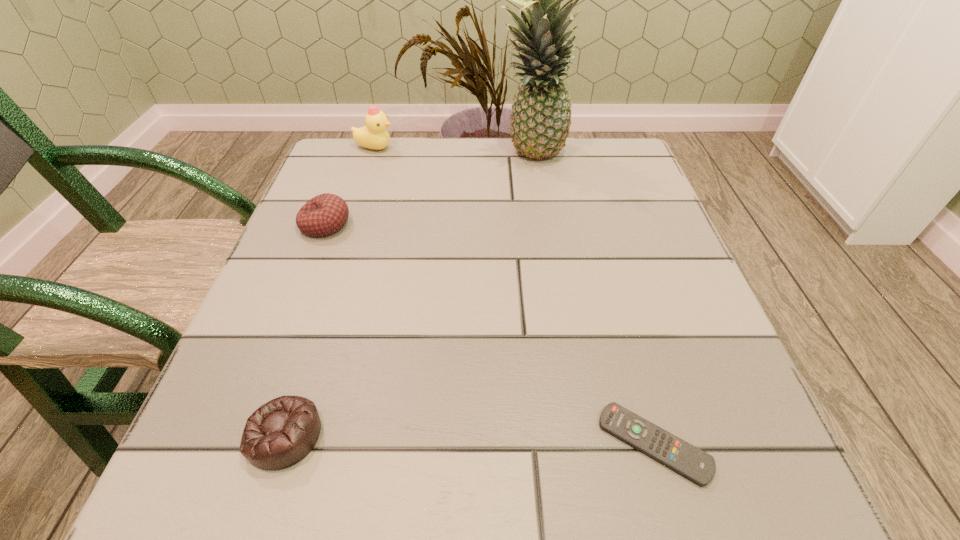
This screenshot has width=960, height=540. In order to click on pineapple in this screenshot , I will do `click(541, 115)`.

Where is `the second tallest object`? The width and height of the screenshot is (960, 540). the second tallest object is located at coordinates (374, 135).

In order to click on the farther beanbag in this screenshot , I will do `click(323, 215)`.

Where is `the third nearest object`? The image size is (960, 540). the third nearest object is located at coordinates (323, 215).

Find the location of a particular element. the nearer beanbag is located at coordinates (279, 434).

You are a GUI agent. You are given a task and a screenshot of the screen. Output one action in this format:
    pyautogui.click(x=<x>, y=<y>)
    Task: Click on the shorter beanbag
    
    Given the screenshot: What is the action you would take?
    pyautogui.click(x=279, y=434)

Identify the location of remote control. pos(699,467).

The width and height of the screenshot is (960, 540). Identify the location of vacant space located on the right of the tallest object. (633, 155).

Find the location of `vacant area situated 0.240m on the front-facing side of the fourth shortest object`. vacant area situated 0.240m on the front-facing side of the fourth shortest object is located at coordinates (492, 148).

Identify the location of vacant space located 0.320m on the front of the farther beanbag. The width and height of the screenshot is (960, 540). (263, 388).